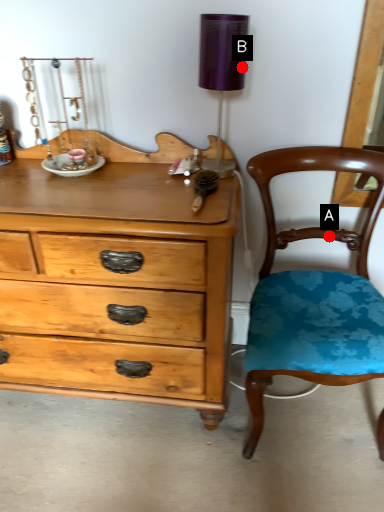
Question: Two points are circled on the image, labeled by A and B beside each circle. Which point is farther from the camera taking this photo?

Choices:
 (A) A is further
 (B) B is further

Answer: (A)